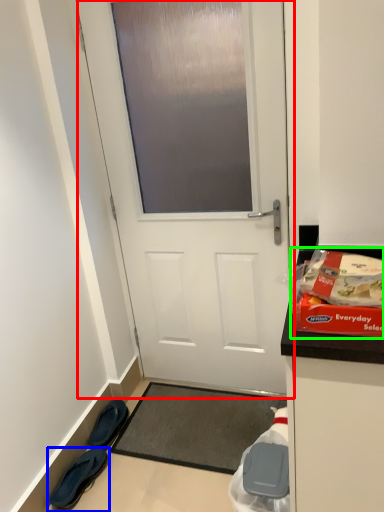
Question: Which object is the farthest from door (highlighted by a red box)? Choose among these: footwear (highlighted by a blue box) or waste (highlighted by a green box).

Choices:
 (A) footwear
 (B) waste

Answer: (A)